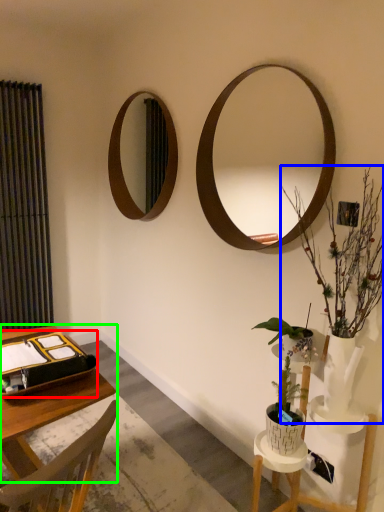
Question: Which is nearer to the binder (highlighted by a red box)? houseplant (highlighted by a blue box) or vanity (highlighted by a green box).

Choices:
 (A) houseplant
 (B) vanity

Answer: (B)